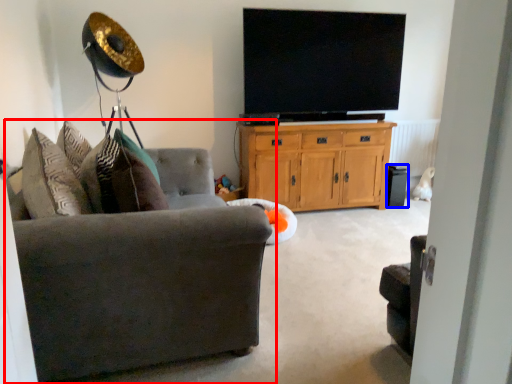
Question: Which point is further to the camera, studio couch (highlighted by a red box) or speaker (highlighted by a blue box)?

Choices:
 (A) studio couch
 (B) speaker

Answer: (B)